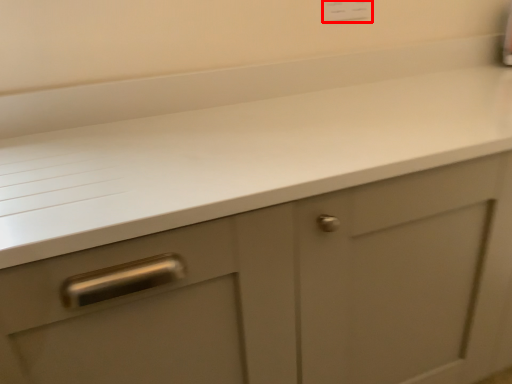
Question: From the image's perspective, considering the relative positions of electric outlet (annotated by the red box) and countertop in the image provided, where is electric outlet (annotated by the red box) located with respect to the staircase?

Choices:
 (A) above
 (B) below

Answer: (A)